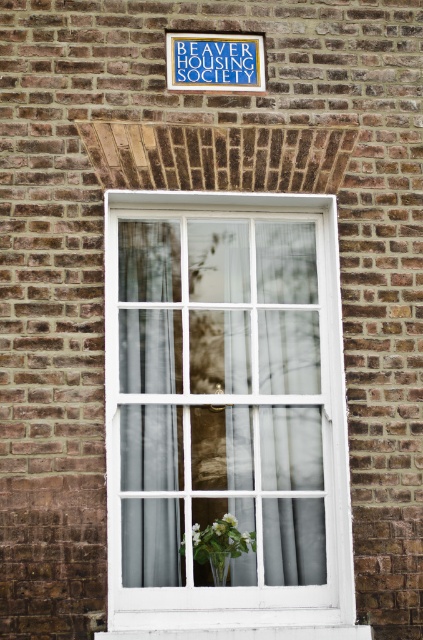
Question: Is green leafy plant at center to the left of translucent glass vase at lower center from the viewer's perspective?

Choices:
 (A) no
 (B) yes

Answer: (B)

Question: Based on their relative distances, which object is farther from the white painted wood window at center?

Choices:
 (A) white sheer curtain at center
 (B) translucent glass vase at lower center
 (C) blue plastic sign at upper center

Answer: (C)

Question: Which point is farther to the camera?

Choices:
 (A) (219, 582)
 (B) (189, 40)
 (C) (173, 419)
 (D) (216, 568)

Answer: (B)

Question: Considering the relative positions of green leafy plant at center and translucent glass vase at lower center in the image provided, where is green leafy plant at center located with respect to translucent glass vase at lower center?

Choices:
 (A) below
 (B) above

Answer: (B)

Question: Among these objects, which one is nearest to the camera?

Choices:
 (A) green leafy plant at center
 (B) white sheer curtain at center

Answer: (B)

Question: Is white painted wood window at center smaller than green leafy plant at center?

Choices:
 (A) yes
 (B) no

Answer: (B)